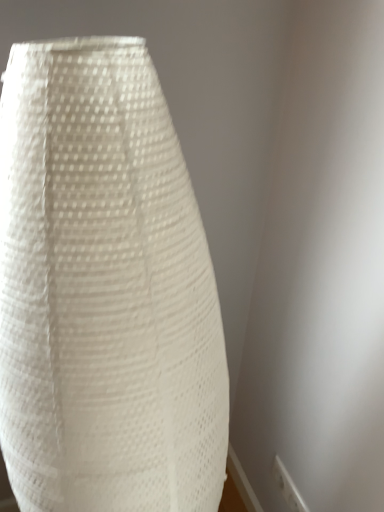
What do you see at coordinates (104, 290) in the screenshot? I see `white textured lamp at center` at bounding box center [104, 290].

Locate an element on the screen. This screenshot has height=512, width=384. white textured lamp at center is located at coordinates (104, 290).

Image resolution: width=384 pixels, height=512 pixels. I want to click on white textured lamp at center, so click(x=104, y=290).